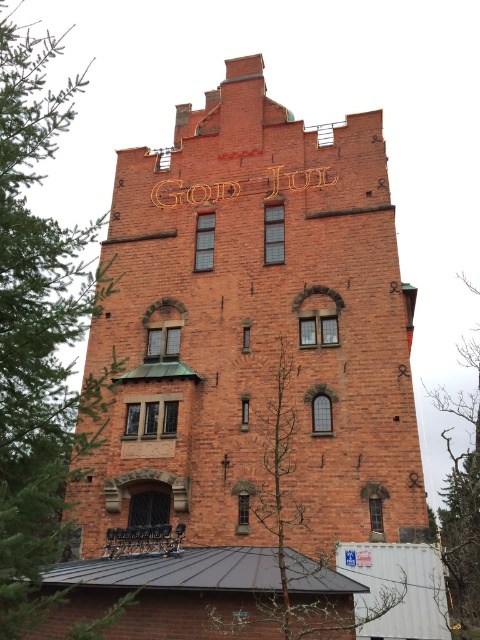
Measure the distance between green leafy tree at left and camera.

green leafy tree at left is 20.35 meters from camera.

Can you confirm if green leafy tree at left is taller than bare branches at center?

Yes.

Is point (9, 422) positioned before point (279, 461)?

Yes, it is.

The image size is (480, 640). In order to click on green leafy tree at left in this screenshot , I will do `click(38, 330)`.

Which of these two, red brick tower at center or bare branches at center, stands shorter?

With less height is bare branches at center.

Can you confirm if red brick tower at center is shorter than bare branches at center?

Incorrect, red brick tower at center's height does not fall short of bare branches at center's.

Is point (355, 248) less distant than point (287, 524)?

No.

The width and height of the screenshot is (480, 640). Find the location of `red brick tower at center`. red brick tower at center is located at coordinates (254, 330).

Does bare branches at center appear on the left side of bare branches at right?

Yes, bare branches at center is to the left of bare branches at right.

Which of these two, bare branches at center or bare branches at right, stands taller?

With more height is bare branches at right.

Locate an element on the screen. This screenshot has height=640, width=480. bare branches at center is located at coordinates (288, 536).